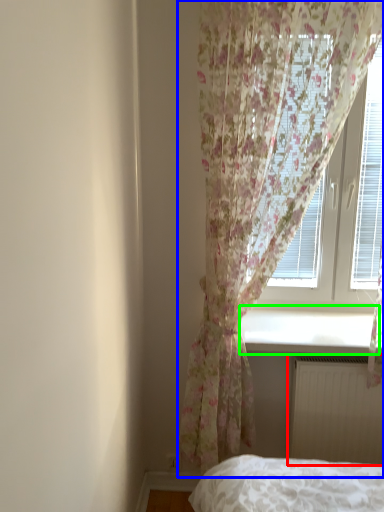
Question: Considering the real-world distances, which object is farthest from radiator (highlighted by a red box)? curtain (highlighted by a blue box) or window sill (highlighted by a green box)?

Choices:
 (A) curtain
 (B) window sill

Answer: (A)